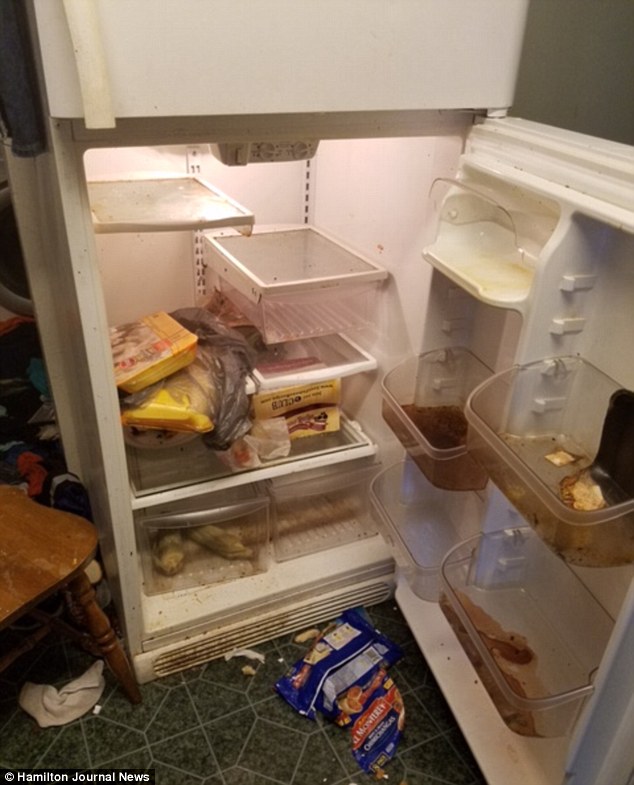
I want to click on chair, so click(x=34, y=566).